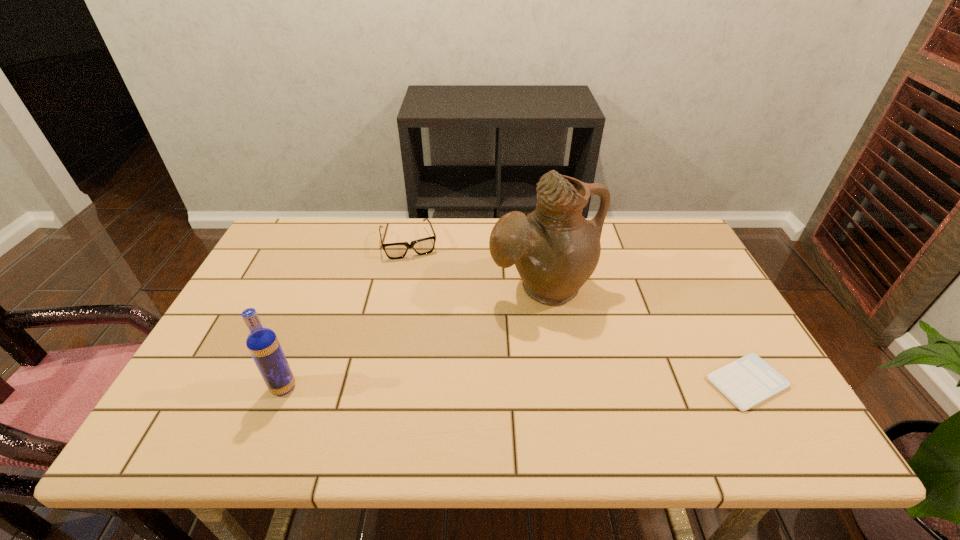
Where is `empty space that is in between the calculator and the second farthest object`? empty space that is in between the calculator and the second farthest object is located at coordinates (644, 335).

The image size is (960, 540). Find the location of `vacant space in between the shortest object and the second shortest object`. vacant space in between the shortest object and the second shortest object is located at coordinates pyautogui.click(x=578, y=313).

Where is `blank region between the rightmost object and the third object from right to left`? Image resolution: width=960 pixels, height=540 pixels. blank region between the rightmost object and the third object from right to left is located at coordinates (578, 313).

This screenshot has width=960, height=540. In order to click on vacant point located between the tallest object and the leftmost object in this screenshot , I will do `click(413, 338)`.

The height and width of the screenshot is (540, 960). Identify the location of free spot between the second tallest object and the calculator. (516, 385).

Identify the location of vacant area that lies between the leftmost object and the farthest object. (347, 315).

This screenshot has width=960, height=540. I want to click on vacant area that lies between the second farthest object and the leftmost object, so click(x=413, y=338).

Where is `vacant space in between the leftmost object and the third object from right to left`? Image resolution: width=960 pixels, height=540 pixels. vacant space in between the leftmost object and the third object from right to left is located at coordinates (347, 315).

This screenshot has width=960, height=540. Find the location of `object identified as the second closest to the vodka`. object identified as the second closest to the vodka is located at coordinates (555, 249).

The height and width of the screenshot is (540, 960). In order to click on object that is the nearest to the leftmost object in this screenshot , I will do `click(423, 246)`.